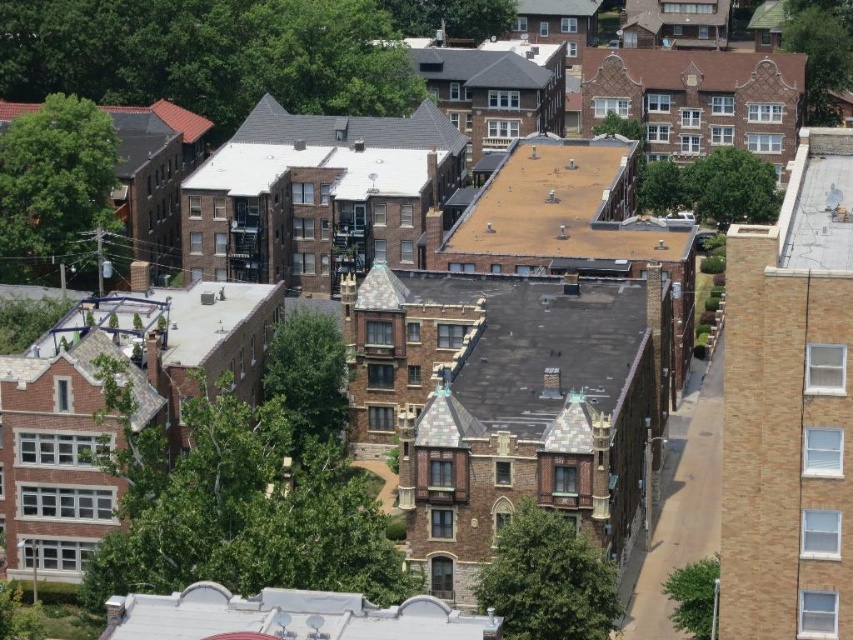
Question: Does brown shingles at center come behind brown shingles at upper right?

Choices:
 (A) no
 (B) yes

Answer: (A)

Question: Which object is farther from the camera taking this photo?

Choices:
 (A) brown shingles at center
 (B) white matte roof at lower center

Answer: (A)

Question: Is brown shingles at center smaller than white matte roof at lower center?

Choices:
 (A) yes
 (B) no

Answer: (B)

Question: Is white matte roof at lower center wider than brown shingles at upper right?

Choices:
 (A) no
 (B) yes

Answer: (A)

Question: Which point appears farthest from the camera in this image?

Choices:
 (A) (358, 616)
 (B) (762, 58)
 (C) (480, 268)

Answer: (B)

Question: Estimate the real-world distances between objects in this image. Which object is farther from the brown shingles at upper right?

Choices:
 (A) white matte roof at lower center
 (B) brown shingles at center

Answer: (A)